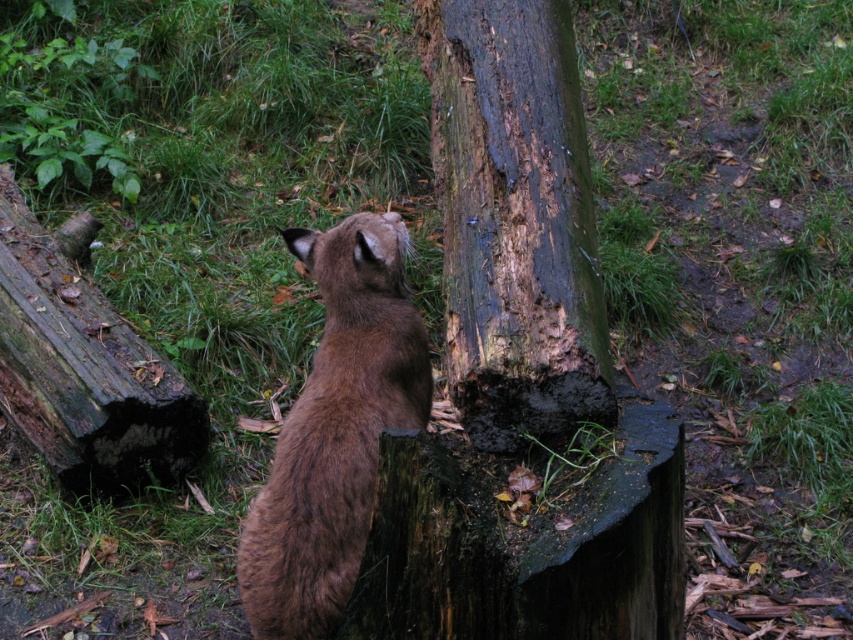
Between dark brown wood at center and brown furry cat at center, which one has less height?

brown furry cat at center

Who is lower down, dark brown wood at center or brown furry cat at center?

Positioned lower is brown furry cat at center.

Who is more forward, (500,400) or (311,576)?

Point (500,400) is in front.

Find the location of a particular element. The width and height of the screenshot is (853, 640). dark brown wood at center is located at coordinates (515, 220).